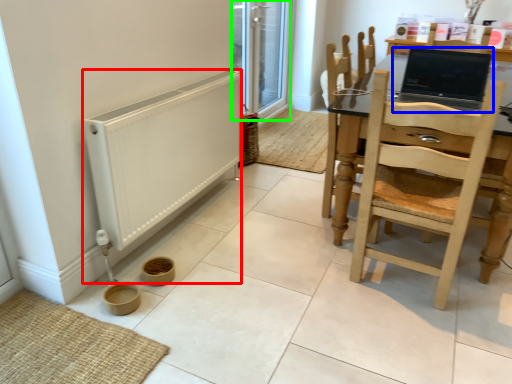
Question: Which object is positioned closest to heater (highlighted by a red box)? Select from laptop (highlighted by a blue box) and screen door (highlighted by a green box).

Choices:
 (A) laptop
 (B) screen door

Answer: (A)